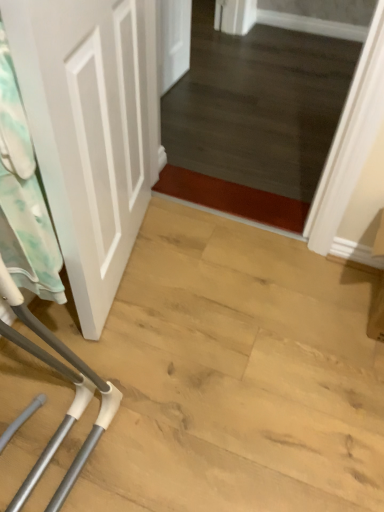
Question: From a real-world perspective, is white fabric laundry at left below white matte door at left?

Choices:
 (A) yes
 (B) no

Answer: (A)

Question: Can you confirm if white fabric laundry at left is shorter than white matte door at left?

Choices:
 (A) no
 (B) yes

Answer: (B)

Question: Are white fabric laundry at left and white matte door at left located far from each other?

Choices:
 (A) yes
 (B) no

Answer: (B)

Question: Is white fabric laundry at left behind white matte door at left?

Choices:
 (A) no
 (B) yes

Answer: (B)

Question: Considering the relative sizes of white fabric laundry at left and white matte door at left in the image provided, is white fabric laundry at left smaller than white matte door at left?

Choices:
 (A) no
 (B) yes

Answer: (B)

Question: Is white fabric laundry at left directly adjacent to white matte door at left?

Choices:
 (A) no
 (B) yes

Answer: (A)

Question: Considering the relative positions of white matte door at left and white fabric laundry at left in the image provided, is white matte door at left to the right of white fabric laundry at left from the viewer's perspective?

Choices:
 (A) no
 (B) yes

Answer: (B)

Question: Is white matte door at left closer to the viewer compared to white fabric laundry at left?

Choices:
 (A) yes
 (B) no

Answer: (A)

Question: From a real-world perspective, is white matte door at left physically above white fabric laundry at left?

Choices:
 (A) yes
 (B) no

Answer: (A)

Question: Can you confirm if white matte door at left is smaller than white fabric laundry at left?

Choices:
 (A) no
 (B) yes

Answer: (A)

Question: Can you confirm if white matte door at left is wider than white fabric laundry at left?

Choices:
 (A) yes
 (B) no

Answer: (A)

Question: Does white matte door at left have a lesser width compared to white fabric laundry at left?

Choices:
 (A) no
 (B) yes

Answer: (A)

Question: Considering the positions of white matte door at left and white fabric laundry at left in the image, is white matte door at left bigger or smaller than white fabric laundry at left?

Choices:
 (A) small
 (B) big

Answer: (B)